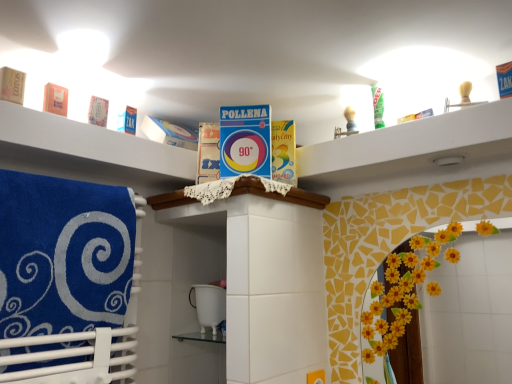
Identify the location of blue soft towel at left. Image resolution: width=512 pixels, height=384 pixels. (63, 255).

What do you see at coordinates (63, 255) in the screenshot? I see `blue soft towel at left` at bounding box center [63, 255].

What is the approximate height of white cardboard box at upper center?

9.64 centimeters.

The image size is (512, 384). What do you see at coordinates (92, 142) in the screenshot?
I see `white cardboard box at upper center` at bounding box center [92, 142].

What are the coordinates of `white cardboard box at upper center` in the screenshot? It's located at (92, 142).

You are a GUI agent. You are given a task and a screenshot of the screen. Output one action in this format:
    pyautogui.click(x=<x>, y=<y>)
    Task: Click on the blue soft towel at left
    This screenshot has width=512, height=384.
    Given the screenshot: What is the action you would take?
    pyautogui.click(x=63, y=255)

Is blue soft towel at left to the right of white cardboard box at upper center from the viewer's perspective?

No.

Between blue soft towel at left and white cardboard box at upper center, which one is positioned behind?

white cardboard box at upper center is more distant.

Is point (26, 210) farther from camera compared to point (65, 139)?

No.

From the image's perspective, is blue soft towel at left beneath white cardboard box at upper center?

Yes, from the image's perspective, blue soft towel at left is beneath white cardboard box at upper center.

From a real-world perspective, is blue soft towel at left under white cardboard box at upper center?

Yes, from a real-world perspective, blue soft towel at left is below white cardboard box at upper center.

Based on the photo, looking at their sizes, would you say blue soft towel at left is wider or thinner than white cardboard box at upper center?

blue soft towel at left is thinner than white cardboard box at upper center.

Consider the image. Is blue soft towel at left taller or shorter than white cardboard box at upper center?

blue soft towel at left is taller than white cardboard box at upper center.

Based on the photo, in terms of size, does blue soft towel at left appear bigger or smaller than white cardboard box at upper center?

blue soft towel at left is bigger than white cardboard box at upper center.

Choose the correct answer: Is blue soft towel at left inside white cardboard box at upper center or outside it?

blue soft towel at left is located beyond the bounds of white cardboard box at upper center.

Is there a large distance between blue soft towel at left and white cardboard box at upper center?

blue soft towel at left is near white cardboard box at upper center, not far away.

Looking at this image, could you tell me if blue soft towel at left is turned towards white cardboard box at upper center?

No, blue soft towel at left is not aimed at white cardboard box at upper center.

How many degrees apart are the facing directions of blue soft towel at left and white cardboard box at upper center?

There is a 1.33-degree angle between the facing directions of blue soft towel at left and white cardboard box at upper center.

How distant is blue soft towel at left from white cardboard box at upper center?

blue soft towel at left and white cardboard box at upper center are 8.83 inches apart from each other.

Find the location of `beach towel that appears on the left of white cardboard box at upper center`. beach towel that appears on the left of white cardboard box at upper center is located at coordinates (63, 255).

Which object is positioned more to the left, white cardboard box at upper center or blue soft towel at left?

From the viewer's perspective, blue soft towel at left appears more on the left side.

Is white cardboard box at upper center in front of or behind blue soft towel at left in the image?

In the image, white cardboard box at upper center appears behind blue soft towel at left.

Is point (78, 136) less distant than point (67, 247)?

No, (78, 136) is further to viewer.

From the image's perspective, who appears lower, white cardboard box at upper center or blue soft towel at left?

From the image's view, blue soft towel at left is below.

From a real-world perspective, is white cardboard box at upper center physically below blue soft towel at left?

No, from a real-world perspective, white cardboard box at upper center is not under blue soft towel at left.

Is white cardboard box at upper center wider or thinner than blue soft towel at left?

Clearly, white cardboard box at upper center has more width compared to blue soft towel at left.

Does white cardboard box at upper center have a lesser height compared to blue soft towel at left?

Indeed, white cardboard box at upper center has a lesser height compared to blue soft towel at left.

Considering the relative sizes of white cardboard box at upper center and blue soft towel at left in the image provided, is white cardboard box at upper center smaller than blue soft towel at left?

Yes.

Is white cardboard box at upper center inside the boundaries of blue soft towel at left, or outside?

white cardboard box at upper center is outside blue soft towel at left.

Would you consider white cardboard box at upper center to be distant from blue soft towel at left?

They are positioned close to each other.

Could you tell me if white cardboard box at upper center is facing blue soft towel at left?

No, white cardboard box at upper center is not oriented towards blue soft towel at left.

Identify the location of beach towel on the left of white cardboard box at upper center. Image resolution: width=512 pixels, height=384 pixels. [x=63, y=255].

Where is `beach towel that is in front of the white cardboard box at upper center`? The image size is (512, 384). beach towel that is in front of the white cardboard box at upper center is located at coordinates (63, 255).

Find the location of a particular element. shelf above the blue soft towel at left (from the image's perspective) is located at coordinates (92, 142).